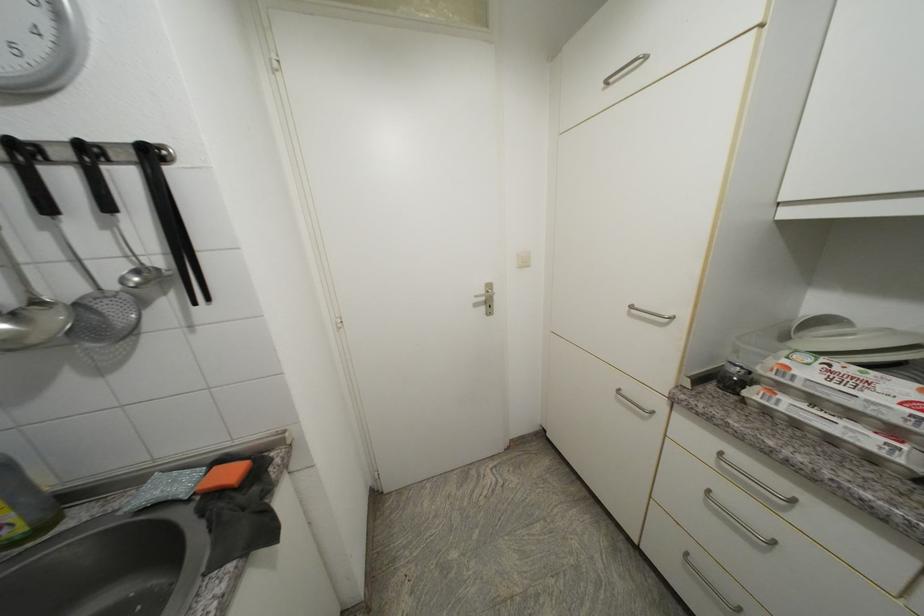
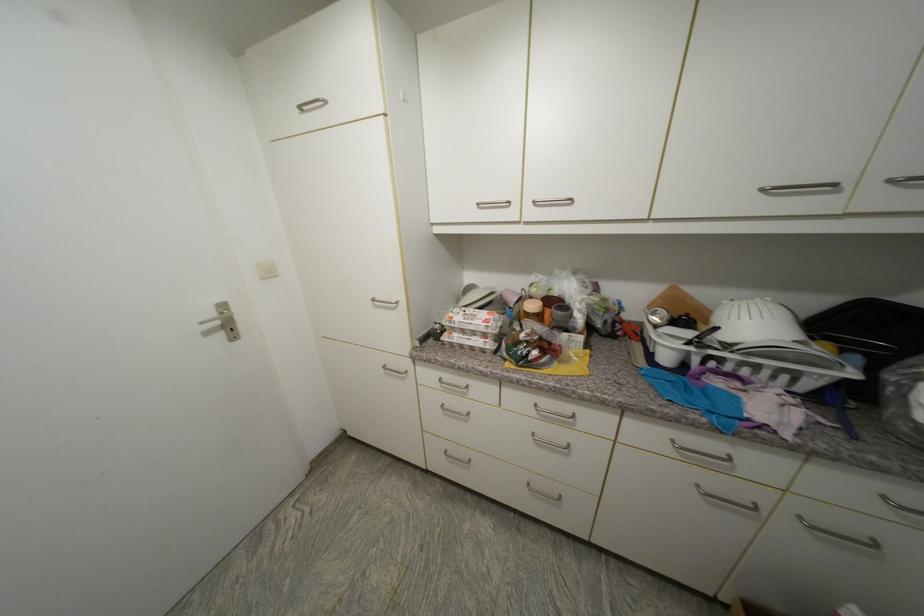
In the second image, find the point that corresponds to (489,293) in the first image.

(220, 315)